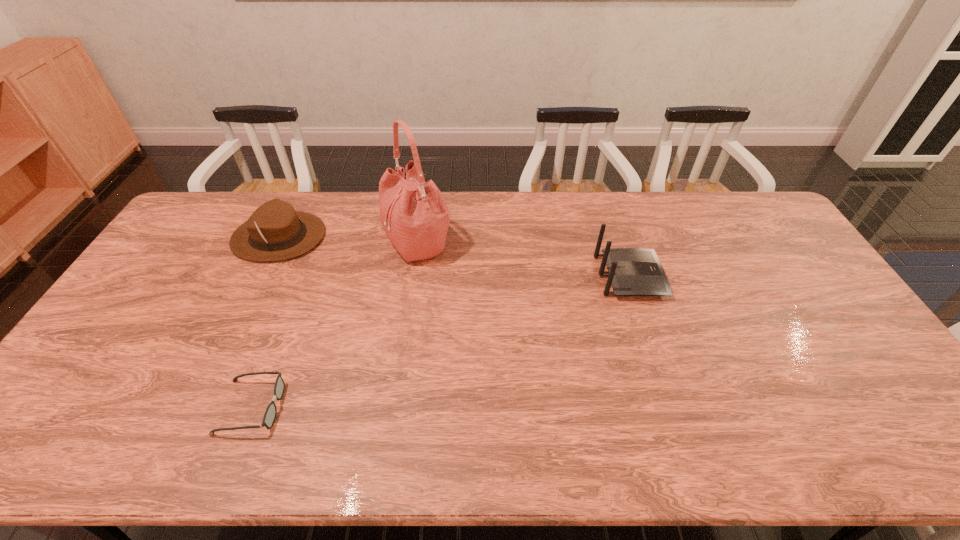
Locate an element on the screen. handbag is located at coordinates (414, 215).

The width and height of the screenshot is (960, 540). I want to click on the tallest object, so click(x=414, y=215).

I want to click on fedora, so click(x=275, y=231).

Find the location of a particular element. router is located at coordinates (632, 271).

What are the coordinates of `the nearest object` in the screenshot? It's located at (269, 417).

At what (x,y) coordinates should I click in order to perform the action: click on the shortest object. Please return your answer as a coordinate pair (x, y). Image resolution: width=960 pixels, height=540 pixels. Looking at the image, I should click on (269, 417).

Find the location of a particular element. vacant space located on the front of the handbag is located at coordinates (406, 322).

I want to click on free space located 0.100m on the feather side of the fedora, so click(354, 237).

The height and width of the screenshot is (540, 960). Identify the location of blank space located on the front-facing side of the rightmost object. (719, 276).

Where is `blank area located on the face of the nearest object`? blank area located on the face of the nearest object is located at coordinates (301, 407).